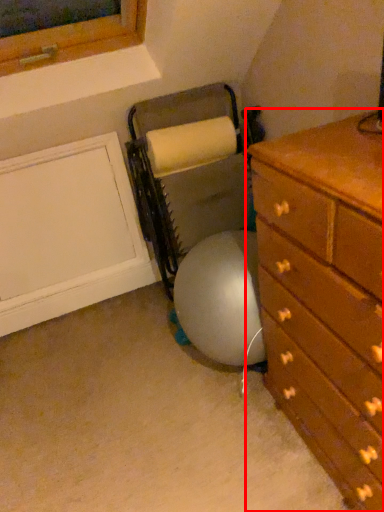
Question: From the image's perspective, where is chest of drawers (annotated by the red box) located in relation to bean bag chair in the image?

Choices:
 (A) below
 (B) above

Answer: (A)